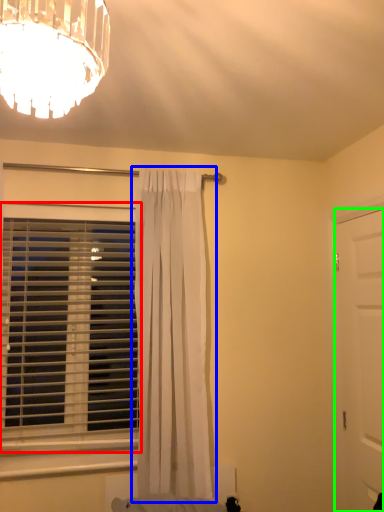
Question: Estimate the real-world distances between objects in this image. Which object is farther from window blind (highlighted by a red box), curtain (highlighted by a blue box) or door (highlighted by a green box)?

Choices:
 (A) curtain
 (B) door

Answer: (B)